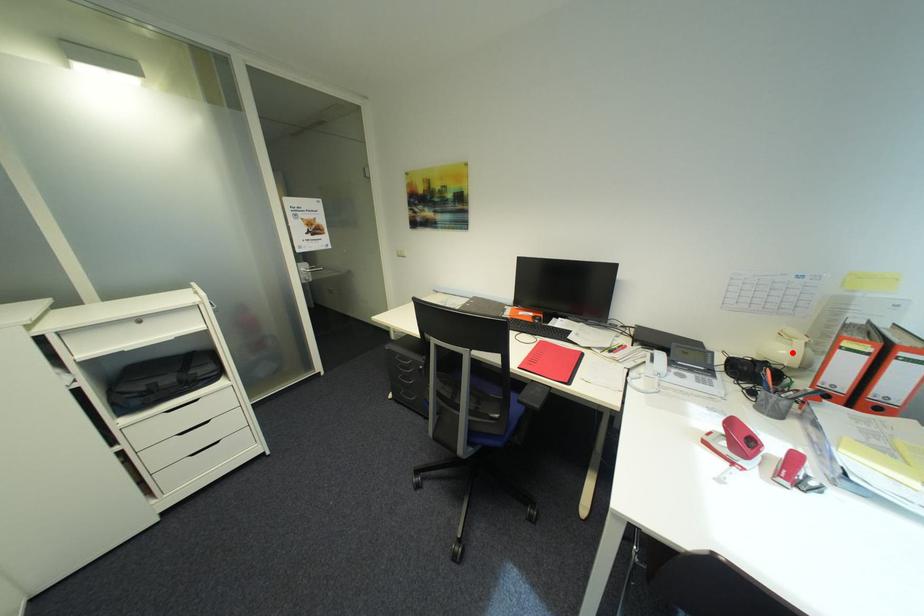
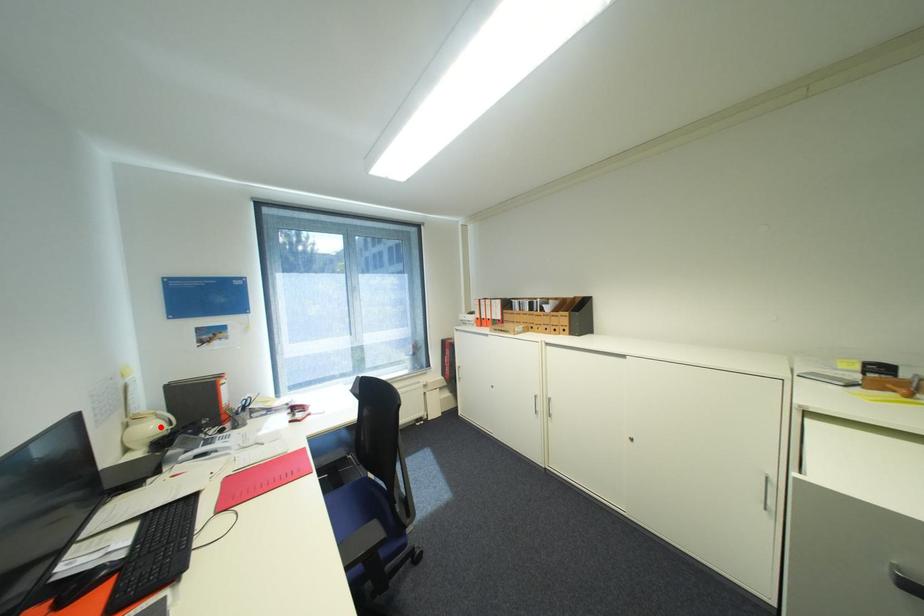
I am providing you with two images of the same scene from different viewpoints. A red point is marked on the first image and another point is marked on the second image. Do the highlighted points in image1 and image2 indicate the same real-world spot?

Yes